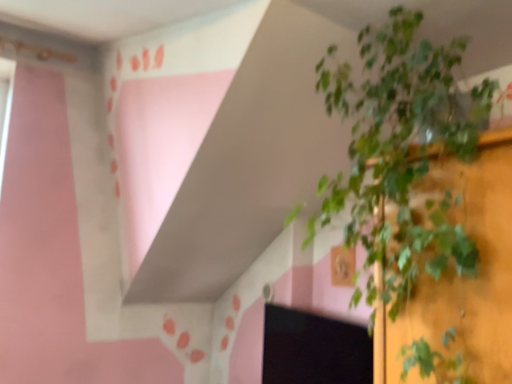
Question: Considering the positions of black matte computer screen at lower right and green leafy plant at center in the image, is black matte computer screen at lower right wider or thinner than green leafy plant at center?

Choices:
 (A) thin
 (B) wide

Answer: (A)

Question: In the image, is black matte computer screen at lower right positioned in front of or behind green leafy plant at center?

Choices:
 (A) behind
 (B) front

Answer: (A)

Question: From a real-world perspective, is black matte computer screen at lower right positioned above or below green leafy plant at center?

Choices:
 (A) above
 (B) below

Answer: (B)

Question: Is green leafy plant at center inside the boundaries of black matte computer screen at lower right, or outside?

Choices:
 (A) inside
 (B) outside

Answer: (B)

Question: In the image, is green leafy plant at center positioned in front of or behind black matte computer screen at lower right?

Choices:
 (A) behind
 (B) front

Answer: (B)

Question: From the image's perspective, is green leafy plant at center located above or below black matte computer screen at lower right?

Choices:
 (A) above
 (B) below

Answer: (A)

Question: Looking at the image, does green leafy plant at center seem bigger or smaller compared to black matte computer screen at lower right?

Choices:
 (A) small
 (B) big

Answer: (B)